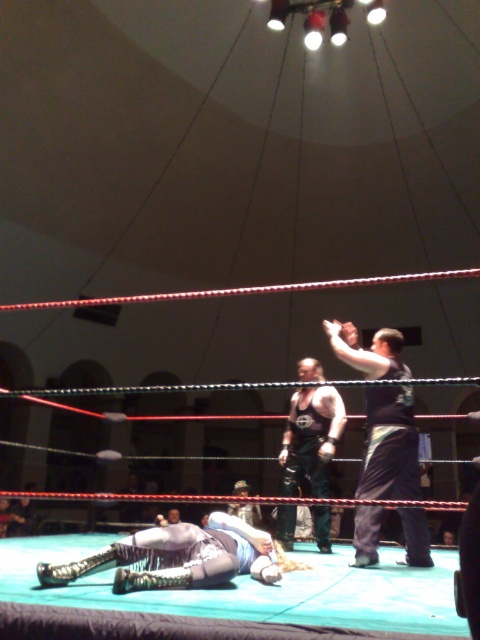
You are a photographer positioned at the arena floor. You need to capture a closeup shot of the dark blue fabric shirt at upper right and the black leather boots at center. Since your camera has a fixed focus distance, which object should you focus on to ensure both are in frame?

The dark blue fabric shirt at upper right is larger in size compared to the black leather boots at center. To ensure both are in frame, focus on the larger object, the dark blue fabric shirt at upper right, as it requires more space.

You are a photographer standing near the wrestling ring. You want to capture a photo that includes both the dark blue fabric shirt at upper right and the black leather boots at center. Given that your camera has a maximum focus range of 36 inches, will you be able to include both in the same frame without moving closer?

The dark blue fabric shirt at upper right and black leather boots at center are 36.22 inches apart. Since the distance between them exceeds the camera maximum focus range of 36 inches, you will not be able to include both in the same frame without moving closer.